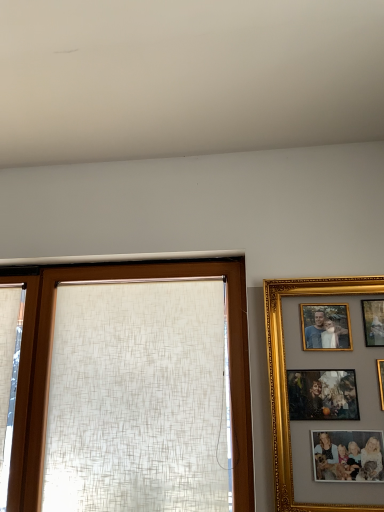
This screenshot has width=384, height=512. In order to click on white textured curtain at left in this screenshot , I will do `click(9, 373)`.

Image resolution: width=384 pixels, height=512 pixels. Find the location of `gold/gilded picture frame at right`. gold/gilded picture frame at right is located at coordinates (286, 377).

Is gold/gilded picture frame at right to the left or to the right of matte beige curtain at center in the image?

From the image, it's evident that gold/gilded picture frame at right is to the right of matte beige curtain at center.

Which of these two, gold/gilded picture frame at right or matte beige curtain at center, is smaller?

With smaller size is gold/gilded picture frame at right.

From the image's perspective, is gold/gilded picture frame at right located beneath matte beige curtain at center?

No.

From a real-world perspective, is gold/gilded picture frame at right below white textured curtain at left?

Indeed, from a real-world perspective, gold/gilded picture frame at right is positioned beneath white textured curtain at left.

In the scene shown: Does gold/gilded picture frame at right have a greater height compared to white textured curtain at left?

Incorrect, the height of gold/gilded picture frame at right is not larger of that of white textured curtain at left.

Between gold/gilded picture frame at right and white textured curtain at left, which one appears on the right side from the viewer's perspective?

gold/gilded picture frame at right is more to the right.

From the image's perspective, which is above, white textured curtain at left or matte beige curtain at center?

From the image's view, matte beige curtain at center is above.

Considering the positions of objects white textured curtain at left and matte beige curtain at center in the image provided, who is behind, white textured curtain at left or matte beige curtain at center?

white textured curtain at left.

Which of these two, white textured curtain at left or matte beige curtain at center, is thinner?

white textured curtain at left is thinner.

Identify the location of window above the gold/gilded picture frame at right (from a real-world perspective). (50, 365).

Which object is closer to the camera, matte beige curtain at center or gold/gilded picture frame at right?

Positioned in front is gold/gilded picture frame at right.

Based on the photo, which object is positioned more to the left, matte beige curtain at center or gold/gilded picture frame at right?

matte beige curtain at center.

From the image's perspective, between white textured curtain at left and gold/gilded picture frame at right, who is located below?

From the image's view, white textured curtain at left is below.

Can you tell me how much white textured curtain at left and gold/gilded picture frame at right differ in facing direction?

There is a 0.258-degree angle between the facing directions of white textured curtain at left and gold/gilded picture frame at right.

Based on their positions, is white textured curtain at left located to the left or right of gold/gilded picture frame at right?

Clearly, white textured curtain at left is on the left of gold/gilded picture frame at right in the image.

Does white textured curtain at left have a greater height compared to gold/gilded picture frame at right?

Indeed, white textured curtain at left has a greater height compared to gold/gilded picture frame at right.

Is white textured curtain at left at the back of matte beige curtain at center?

That's not correct — matte beige curtain at center is not looking away from white textured curtain at left.

Does matte beige curtain at center have a lesser height compared to white textured curtain at left?

Yes.

Does matte beige curtain at center touch white textured curtain at left?

No.

You are a GUI agent. You are given a task and a screenshot of the screen. Output one action in this format:
    pyautogui.click(x=<x>, y=<y>)
    Task: Click on the window lying behind the gold/gilded picture frame at right
    The height and width of the screenshot is (512, 384).
    Given the screenshot: What is the action you would take?
    pyautogui.click(x=50, y=365)

Locate an element on the screen. This screenshot has width=384, height=512. picture frame directly beneath the white textured curtain at left (from a real-world perspective) is located at coordinates (286, 377).

Which object lies further to the anchor point matte beige curtain at center, white textured curtain at left or gold/gilded picture frame at right?

gold/gilded picture frame at right is positioned further to the anchor matte beige curtain at center.

Based on their spatial positions, is gold/gilded picture frame at right or white textured curtain at left closer to matte beige curtain at center?

Based on the image, white textured curtain at left appears to be nearer to matte beige curtain at center.

From the image, which object appears to be nearer to white textured curtain at left, matte beige curtain at center or gold/gilded picture frame at right?

Among the two, matte beige curtain at center is located nearer to white textured curtain at left.

Estimate the real-world distances between objects in this image. Which object is further from white textured curtain at left, gold/gilded picture frame at right or matte beige curtain at center?

Among the two, gold/gilded picture frame at right is located further to white textured curtain at left.

Which object lies nearer to the anchor point gold/gilded picture frame at right, white textured curtain at left or matte beige curtain at center?

Among the two, matte beige curtain at center is located nearer to gold/gilded picture frame at right.

Considering their positions, is matte beige curtain at center positioned further to gold/gilded picture frame at right than white textured curtain at left?

white textured curtain at left.

Identify the location of window situated between white textured curtain at left and gold/gilded picture frame at right from left to right. (50, 365).